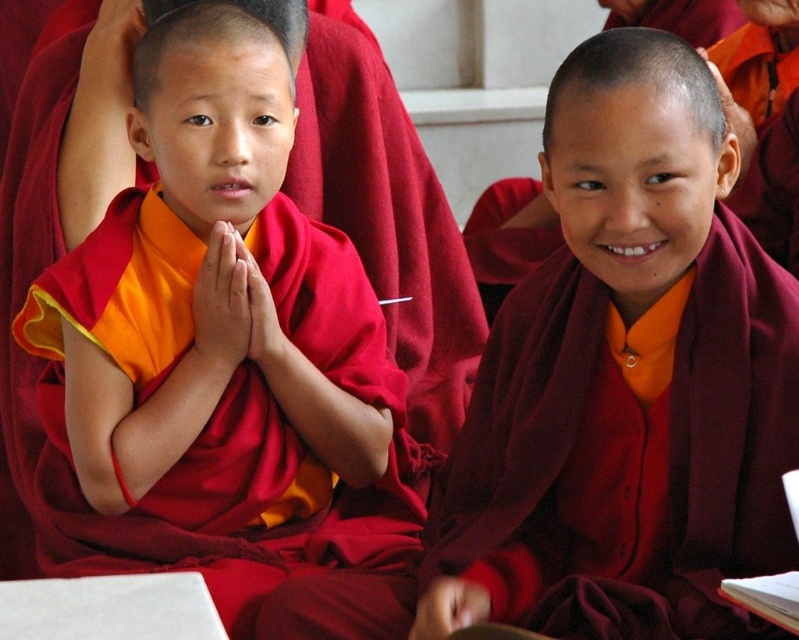
Who is taller, matte red robe at left or maroon woolen robe at center?

matte red robe at left is taller.

Between point (80, 336) and point (784, 355), which one is positioned in front?

Positioned in front is point (784, 355).

Which is behind, point (256, 176) or point (629, 627)?

Point (256, 176)

Locate an element on the screen. matte red robe at left is located at coordinates (217, 340).